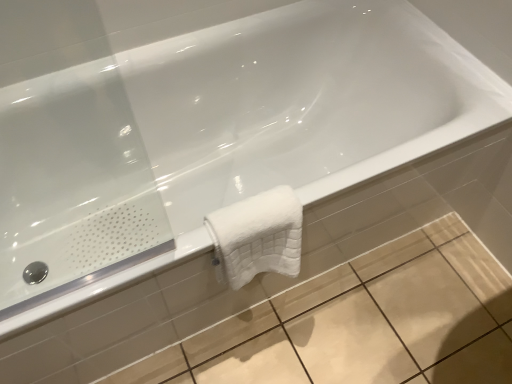
Where is `free space above white fluffy towel at center (from a real-world perspective)`? The height and width of the screenshot is (384, 512). free space above white fluffy towel at center (from a real-world perspective) is located at coordinates (257, 209).